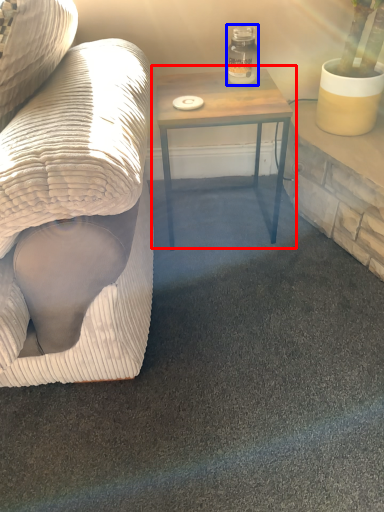
Question: Which object appears farthest to the camera in this image, table (highlighted by a red box) or glass jar (highlighted by a blue box)?

Choices:
 (A) table
 (B) glass jar

Answer: (B)